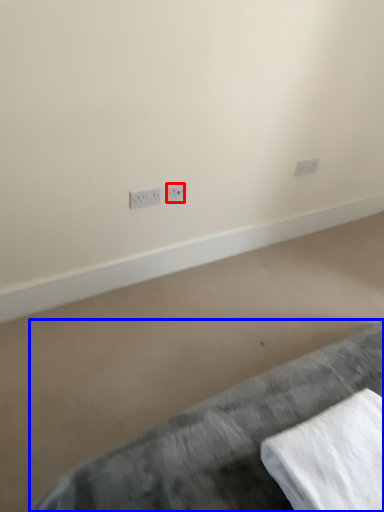
Question: Which object appears closest to the camera in this image, power plugs and sockets (highlighted by a red box) or furniture (highlighted by a blue box)?

Choices:
 (A) power plugs and sockets
 (B) furniture

Answer: (B)